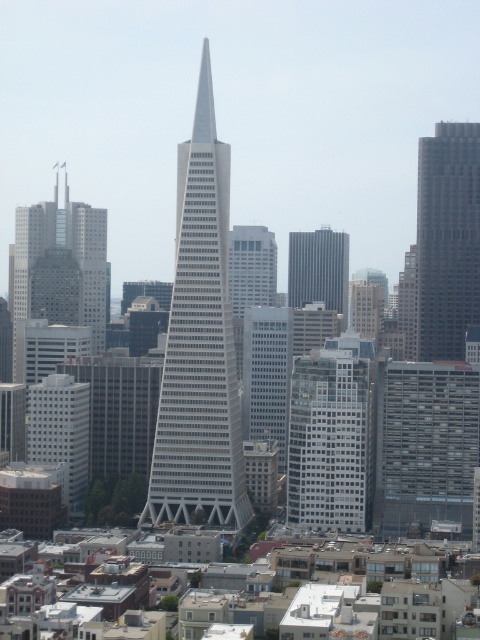
Is white glass building at center above matte glass skyscraper at left?

Incorrect, white glass building at center is not positioned above matte glass skyscraper at left.

Can you confirm if white glass building at center is smaller than matte glass skyscraper at left?

Yes, white glass building at center is smaller than matte glass skyscraper at left.

Does point (301, 376) come behind point (70, 285)?

No, (301, 376) is closer to viewer.

Identify the location of white glass building at center. [330, 440].

This screenshot has height=640, width=480. What do you see at coordinates (200, 346) in the screenshot?
I see `white glass skyscraper at center` at bounding box center [200, 346].

Can you confirm if white glass skyscraper at center is positioned below gray glass skyscraper at center?

→ Yes, white glass skyscraper at center is below gray glass skyscraper at center.

Is point (162, 513) positioned after point (308, 298)?

Yes.

The image size is (480, 640). Find the location of `white glass skyscraper at center`. white glass skyscraper at center is located at coordinates (200, 346).

Can you confirm if matte glass skyscraper at left is bigger than gray glass skyscraper at center?

Yes, matte glass skyscraper at left is bigger than gray glass skyscraper at center.

Does matte glass skyscraper at left appear on the left side of gray glass skyscraper at center?

Yes, matte glass skyscraper at left is to the left of gray glass skyscraper at center.

Where is `matte glass skyscraper at left`? The width and height of the screenshot is (480, 640). matte glass skyscraper at left is located at coordinates (58, 276).

Find the location of a particular element. Image resolution: width=480 pixels, height=640 pixels. matte glass skyscraper at left is located at coordinates (58, 276).